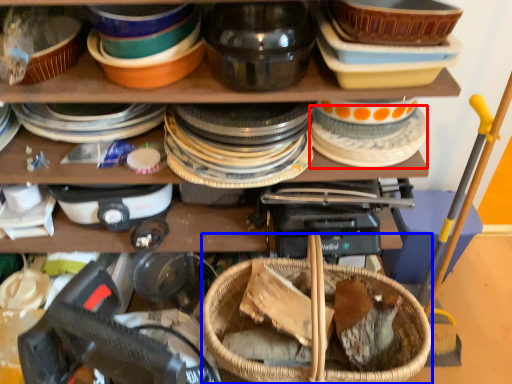
Question: Among these objects, which one is farthest to the camera, tableware (highlighted by a red box) or basket (highlighted by a blue box)?

Choices:
 (A) tableware
 (B) basket

Answer: (A)